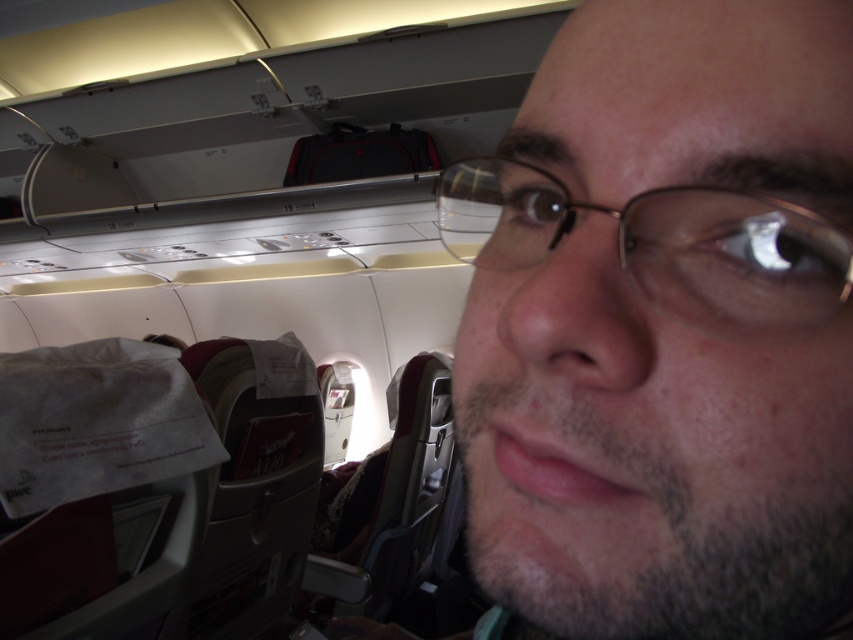
Question: Observing the image, what is the correct spatial positioning of smooth skin face at center in reference to gold-framed glasses at center?

Choices:
 (A) above
 (B) below

Answer: (B)

Question: Which of the following is the farthest from the observer?

Choices:
 (A) smooth skin face at center
 (B) gold-framed glasses at center

Answer: (A)

Question: Is smooth skin face at center smaller than gold-framed glasses at center?

Choices:
 (A) yes
 (B) no

Answer: (B)

Question: Is smooth skin face at center smaller than gold-framed glasses at center?

Choices:
 (A) yes
 (B) no

Answer: (B)